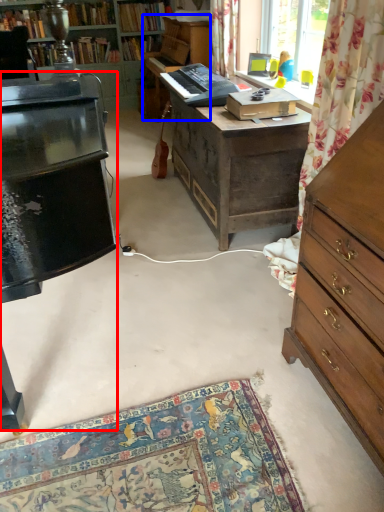
Question: Which of the following is the closest to the observer, piano (highlighted by a red box) or piano (highlighted by a blue box)?

Choices:
 (A) piano
 (B) piano

Answer: (A)